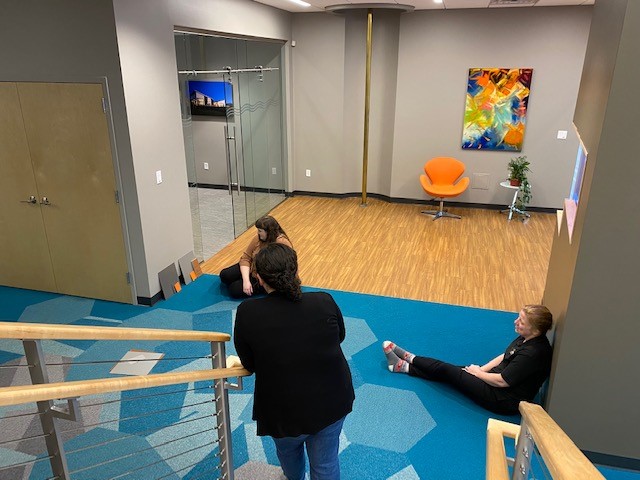
The image size is (640, 480). I want to click on blue carpet ground with geometric shapes, so click(445, 326), click(166, 309).